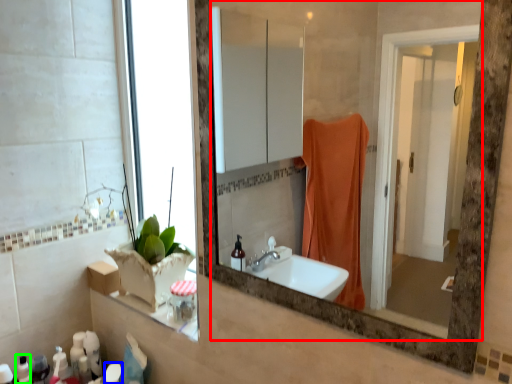
Question: Which object is positioned farthest from mirror (highlighted by a red box)? Select from toiletry (highlighted by a blue box) and toiletry (highlighted by a green box).

Choices:
 (A) toiletry
 (B) toiletry

Answer: (B)